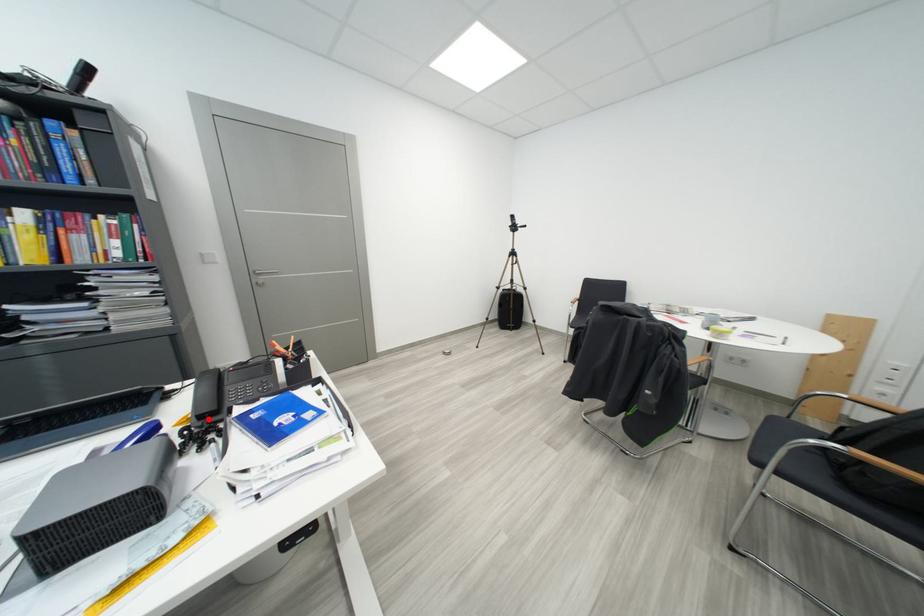
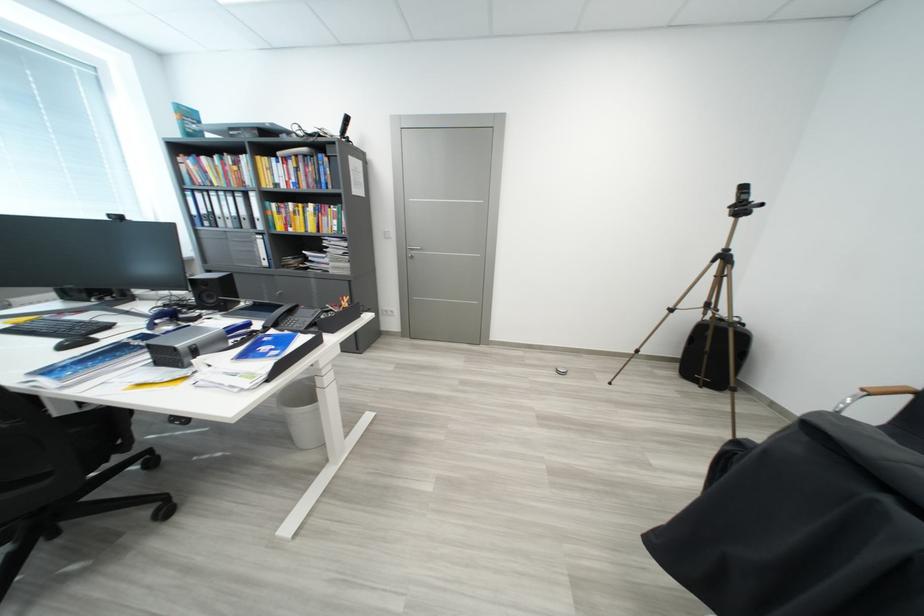
Question: I am providing you with two images of the same scene from different viewpoints. A red point is marked on the first image. Is the red point's position out of view in image 2?

Choices:
 (A) Yes
 (B) No

Answer: (B)